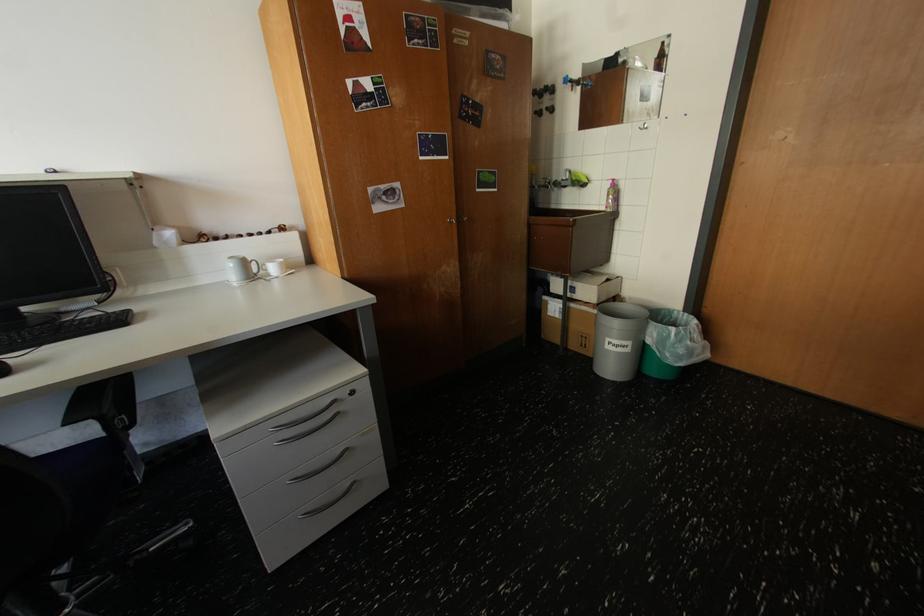
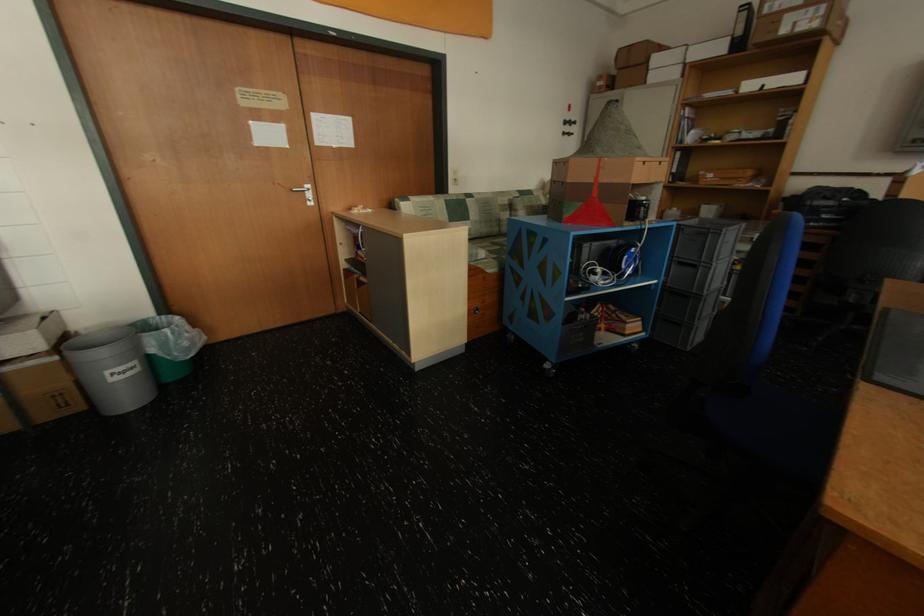
Find the pixel in the second image that matches the point at 638,344 in the first image.

(142, 363)